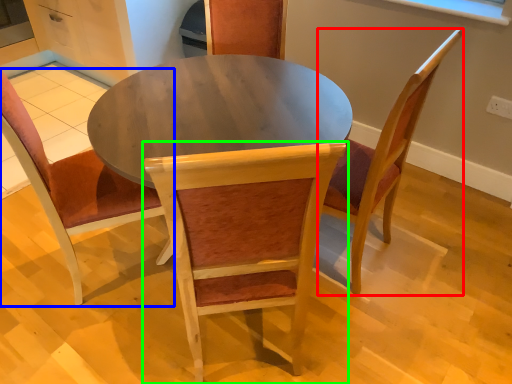
Question: Which is nearer to the chair (highlighted by a red box)? chair (highlighted by a blue box) or chair (highlighted by a green box).

Choices:
 (A) chair
 (B) chair

Answer: (B)